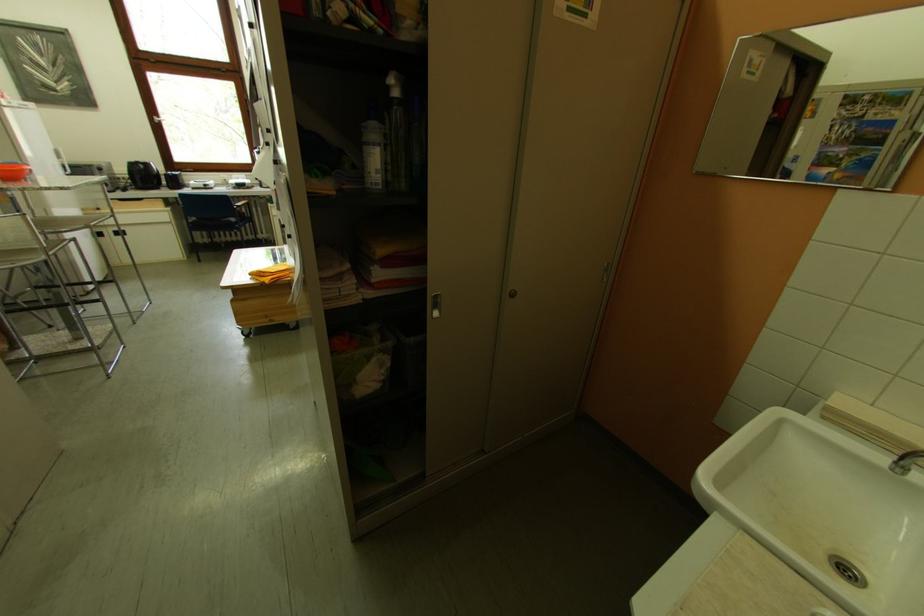
The height and width of the screenshot is (616, 924). In order to click on faucet handle in this screenshot , I will do `click(906, 462)`.